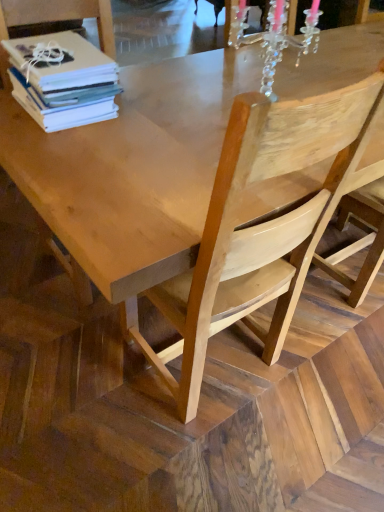
Question: Considering the relative sizes of natural wood chair at center, which is counted as the 1th chair, starting from the left, and clear crystal chandelier at upper center in the image provided, is natural wood chair at center, which is counted as the 1th chair, starting from the left, taller than clear crystal chandelier at upper center?

Choices:
 (A) yes
 (B) no

Answer: (A)

Question: Is natural wood chair at center, positioned as the 3th chair in right-to-left order, with clear crystal chandelier at upper center?

Choices:
 (A) yes
 (B) no

Answer: (B)

Question: Is natural wood chair at center, positioned as the 3th chair in right-to-left order, looking in the opposite direction of clear crystal chandelier at upper center?

Choices:
 (A) yes
 (B) no

Answer: (B)

Question: From the image's perspective, is natural wood chair at center, which is counted as the 1th chair, starting from the left, located beneath clear crystal chandelier at upper center?

Choices:
 (A) no
 (B) yes

Answer: (B)

Question: From a real-world perspective, does natural wood chair at center, positioned as the 3th chair in right-to-left order, stand above clear crystal chandelier at upper center?

Choices:
 (A) no
 (B) yes

Answer: (A)

Question: Considering the positions of point (112, 302) and point (3, 83), is point (112, 302) closer or farther from the camera than point (3, 83)?

Choices:
 (A) closer
 (B) farther

Answer: (A)

Question: From the image's perspective, is natural wood table at center above or below natural wood chair at center, which is counted as the 1th chair, starting from the left?

Choices:
 (A) above
 (B) below

Answer: (A)

Question: From a real-world perspective, is natural wood table at center physically located above or below natural wood chair at center, positioned as the 3th chair in right-to-left order?

Choices:
 (A) above
 (B) below

Answer: (B)

Question: In the image, is natural wood table at center positioned in front of or behind natural wood chair at center, which is counted as the 1th chair, starting from the left?

Choices:
 (A) behind
 (B) front

Answer: (B)

Question: Is white paper stack at upper left in front of or behind clear crystal chandelier at upper center in the image?

Choices:
 (A) front
 (B) behind

Answer: (A)

Question: Does point (49, 46) appear closer or farther from the camera than point (284, 15)?

Choices:
 (A) closer
 (B) farther

Answer: (A)

Question: Considering the relative positions of white paper stack at upper left and clear crystal chandelier at upper center in the image provided, is white paper stack at upper left to the left or to the right of clear crystal chandelier at upper center?

Choices:
 (A) right
 (B) left

Answer: (B)

Question: Would you say white paper stack at upper left is inside or outside clear crystal chandelier at upper center?

Choices:
 (A) outside
 (B) inside

Answer: (A)

Question: From the image's perspective, is natural wood chair at center, the second chair when ordered from left to right, located above or below natural wood chair at center?

Choices:
 (A) above
 (B) below

Answer: (B)

Question: Is point (193, 317) positioned closer to the camera than point (317, 331)?

Choices:
 (A) closer
 (B) farther

Answer: (A)